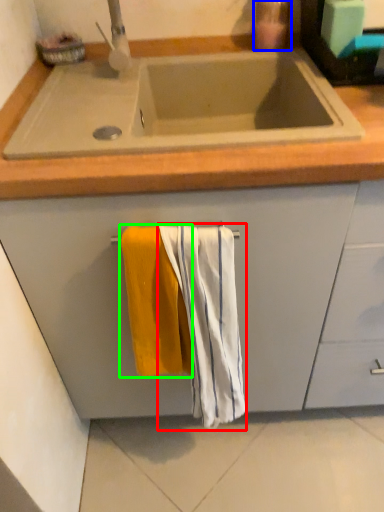
Question: Based on their relative distances, which object is farther from beach towel (highlighted by a red box)? Choose from soap dispenser (highlighted by a blue box) and beach towel (highlighted by a green box).

Choices:
 (A) soap dispenser
 (B) beach towel

Answer: (A)